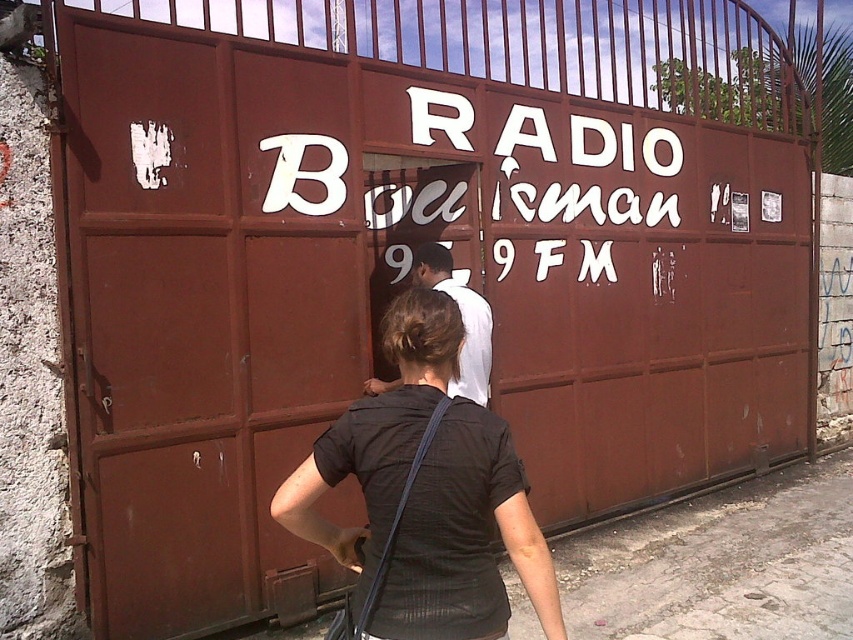
Question: Which of the following is the closest to the observer?

Choices:
 (A) black matte shirt at center
 (B) white cloth shirt at center

Answer: (A)

Question: Which point is closer to the camera?

Choices:
 (A) black matte shirt at center
 (B) white cloth shirt at center

Answer: (A)

Question: Can you confirm if black matte shirt at center is positioned below white cloth shirt at center?

Choices:
 (A) yes
 (B) no

Answer: (A)

Question: Which point is farther to the camera?

Choices:
 (A) (450, 624)
 (B) (421, 252)

Answer: (B)

Question: Can you confirm if black matte shirt at center is positioned to the left of white cloth shirt at center?

Choices:
 (A) yes
 (B) no

Answer: (A)

Question: Is black matte shirt at center smaller than white cloth shirt at center?

Choices:
 (A) yes
 (B) no

Answer: (A)